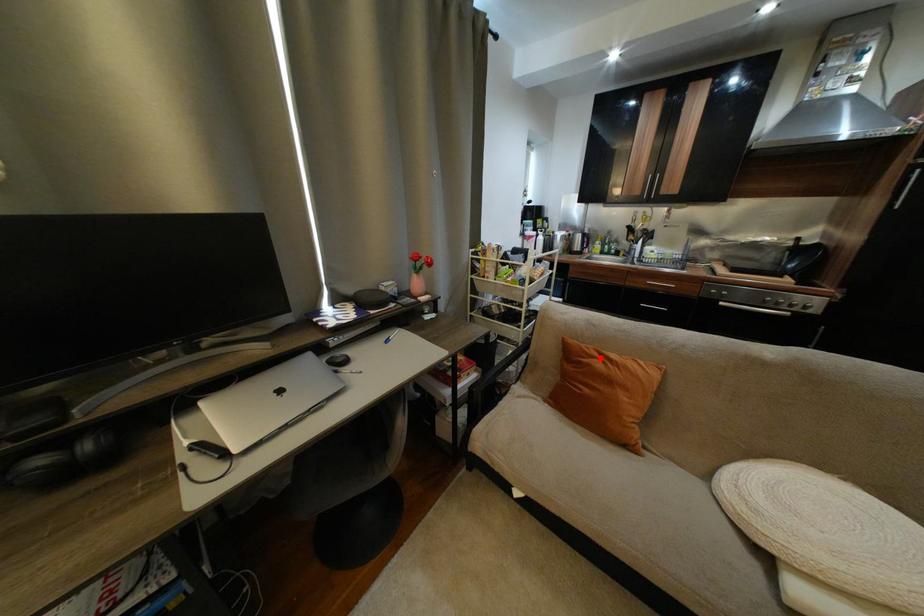
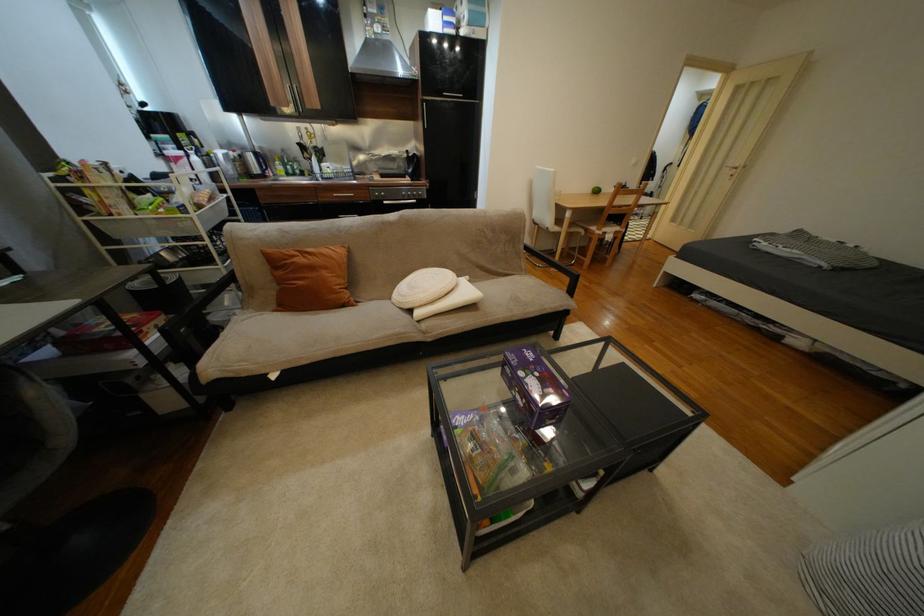
Where in the second image is the point corresponding to the highlighted location from the first image?

(301, 257)